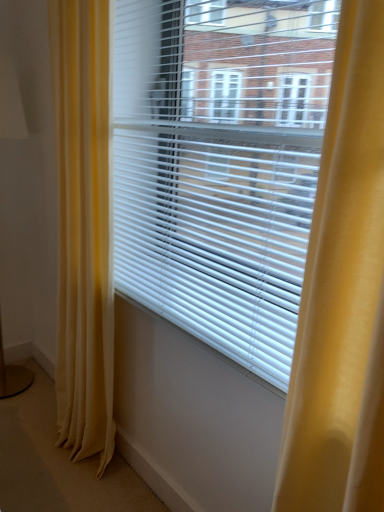
Measure the distance between point (193, 200) and camera.

They are 1.14 meters apart.

Locate an element on the screen. The height and width of the screenshot is (512, 384). matte gold table lamp at left is located at coordinates (x=11, y=103).

At what (x,y) coordinates should I click in order to perform the action: click on silky yellow curtain at left. Please return your answer as a coordinate pair (x, y). This screenshot has width=384, height=512. Looking at the image, I should click on (84, 227).

Does matte gold table lamp at left have a smaller size compared to silky yellow curtain at left?

Correct, matte gold table lamp at left occupies less space than silky yellow curtain at left.

In the scene shown: Is the surface of matte gold table lamp at left in direct contact with silky yellow curtain at left?

matte gold table lamp at left is not next to silky yellow curtain at left, and they're not touching.

Can you confirm if matte gold table lamp at left is positioned to the right of silky yellow curtain at left?

In fact, matte gold table lamp at left is to the left of silky yellow curtain at left.

From the image's perspective, is matte gold table lamp at left on silky yellow curtain at left?

Yes, from the image's perspective, matte gold table lamp at left is above silky yellow curtain at left.

From a real-world perspective, does white plastic blinds at center sit lower than silky yellow curtain at left?

No, from a real-world perspective, white plastic blinds at center is not beneath silky yellow curtain at left.

From the image's perspective, is white plastic blinds at center over silky yellow curtain at left?

Correct, white plastic blinds at center appears higher than silky yellow curtain at left in the image.

The image size is (384, 512). I want to click on window blind in front of the silky yellow curtain at left, so click(220, 165).

Which is more to the left, white plastic blinds at center or silky yellow curtain at left?

From the viewer's perspective, silky yellow curtain at left appears more on the left side.

How distant is silky yellow curtain at left from matte gold table lamp at left?

A distance of 74.92 centimeters exists between silky yellow curtain at left and matte gold table lamp at left.

In the scene shown: Is the depth of silky yellow curtain at left less than that of matte gold table lamp at left?

Yes, silky yellow curtain at left is closer to the viewer.

Where is `curtain that appears on the right of matte gold table lamp at left`? curtain that appears on the right of matte gold table lamp at left is located at coordinates (84, 227).

From a real-world perspective, between silky yellow curtain at left and matte gold table lamp at left, who is vertically higher?

silky yellow curtain at left, from a real-world perspective.

Which object is wider, silky yellow curtain at left or white plastic blinds at center?

Wider between the two is silky yellow curtain at left.

This screenshot has width=384, height=512. In order to click on window blind above the silky yellow curtain at left (from the image's perspective) in this screenshot , I will do `click(220, 165)`.

Consider the image. How many degrees apart are the facing directions of silky yellow curtain at left and white plastic blinds at center?

0.000921 degrees.

Is silky yellow curtain at left bigger or smaller than white plastic blinds at center?

Considering their sizes, silky yellow curtain at left takes up more space than white plastic blinds at center.

From a real-world perspective, is matte gold table lamp at left positioned above or below white plastic blinds at center?

matte gold table lamp at left is situated lower than white plastic blinds at center in the real world.

Which of these two, matte gold table lamp at left or white plastic blinds at center, is thinner?

With smaller width is white plastic blinds at center.

From the image's perspective, does matte gold table lamp at left appear higher than white plastic blinds at center?

Incorrect, from the image's perspective, matte gold table lamp at left is lower than white plastic blinds at center.

Does matte gold table lamp at left appear on the left side of white plastic blinds at center?

Yes, matte gold table lamp at left is to the left of white plastic blinds at center.

From the image's perspective, between white plastic blinds at center and matte gold table lamp at left, who is located below?

matte gold table lamp at left, from the image's perspective.

Between white plastic blinds at center and matte gold table lamp at left, which one has larger width?

With larger width is matte gold table lamp at left.

Is white plastic blinds at center not within matte gold table lamp at left?

Yes, white plastic blinds at center is located beyond the bounds of matte gold table lamp at left.

This screenshot has height=512, width=384. Find the location of `table lamp behind the white plastic blinds at center`. table lamp behind the white plastic blinds at center is located at coordinates pos(11,103).

Where is `curtain on the right of matte gold table lamp at left`? The width and height of the screenshot is (384, 512). curtain on the right of matte gold table lamp at left is located at coordinates [x=84, y=227].

This screenshot has height=512, width=384. Find the location of `curtain to the left of white plastic blinds at center`. curtain to the left of white plastic blinds at center is located at coordinates (84, 227).

Estimate the real-world distances between objects in this image. Which object is further from matte gold table lamp at left, white plastic blinds at center or silky yellow curtain at left?

white plastic blinds at center.

When comparing their distances from silky yellow curtain at left, does matte gold table lamp at left or white plastic blinds at center seem further?

matte gold table lamp at left is positioned further to the anchor silky yellow curtain at left.

Considering their positions, is silky yellow curtain at left positioned closer to white plastic blinds at center than matte gold table lamp at left?

silky yellow curtain at left.

From the image, which object appears to be farther from matte gold table lamp at left, silky yellow curtain at left or white plastic blinds at center?

white plastic blinds at center.

Consider the image. Considering their positions, is white plastic blinds at center positioned closer to silky yellow curtain at left than matte gold table lamp at left?

white plastic blinds at center is positioned closer to the anchor silky yellow curtain at left.

Considering their positions, is matte gold table lamp at left positioned further to white plastic blinds at center than silky yellow curtain at left?

matte gold table lamp at left is positioned further to the anchor white plastic blinds at center.

Where is `curtain positioned between white plastic blinds at center and matte gold table lamp at left from near to far`? This screenshot has height=512, width=384. curtain positioned between white plastic blinds at center and matte gold table lamp at left from near to far is located at coordinates pyautogui.click(x=84, y=227).